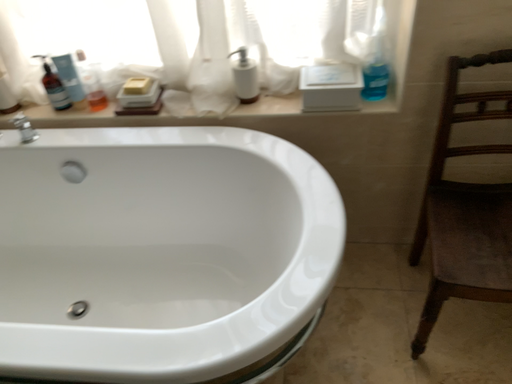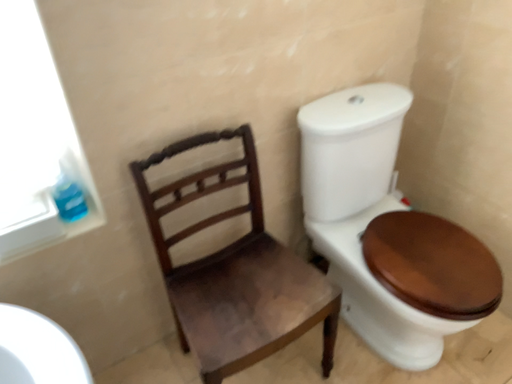
Question: Which way did the camera rotate in the video?

Choices:
 (A) rotated upward
 (B) rotated downward

Answer: (A)